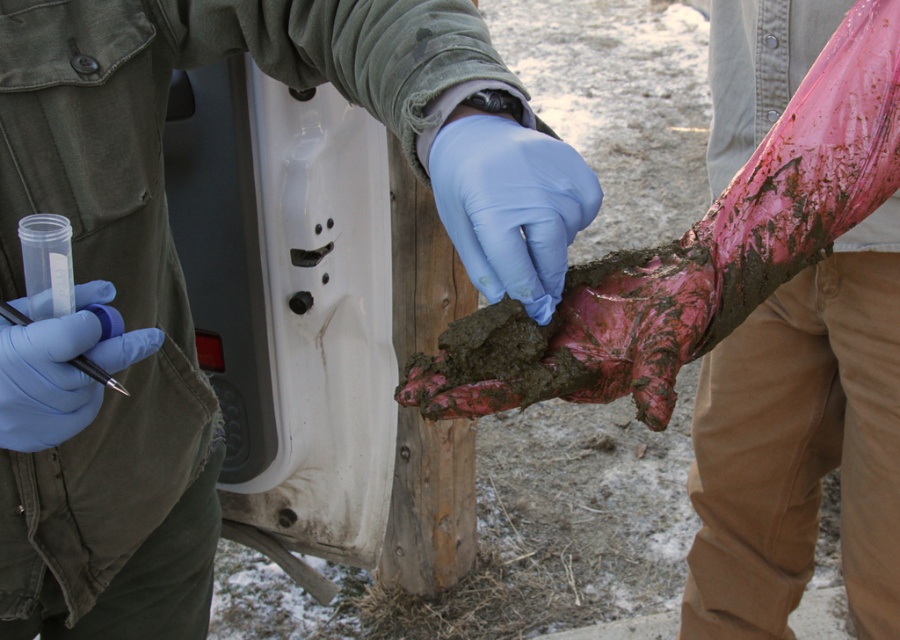
You are a researcher in the field and need to collect a soil sample. You see a muddy rubber glove at center and a muddy plastic bag at center. Which item is closer to you that you can reach first?

The muddy rubber glove at center is closer to the viewer than the muddy plastic bag at center, so you can reach it first.

You are a researcher in the field. You notice a point at coordinates (181, 273) in your camera viewfinder. Based on the scene description, what object is this point likely located on?

The point at coordinates (181, 273) is on the muddy rubber glove at center.

You are a researcher in the field and need to store a sample in the container that can fit inside your backpack. Which object between the muddy rubber glove at center and the muddy plastic bag at center is shorter and thus more likely to fit?

The muddy rubber glove at center is not as tall as the muddy plastic bag at center, so the muddy rubber glove at center is shorter and more likely to fit in the backpack.